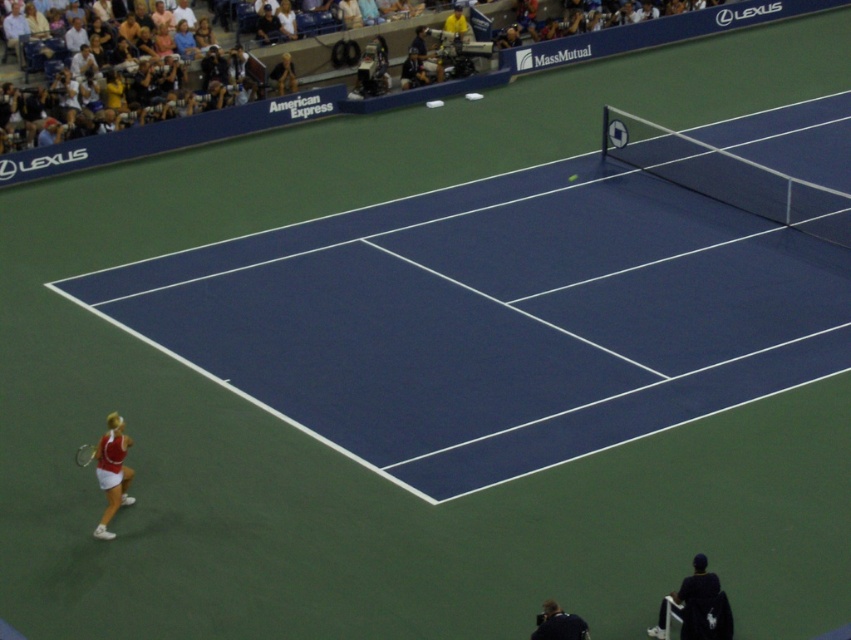
You are standing at the baseline of the tennis court and see the point marked at coordinate (120,477). If you want to reach this point quickly, should you run straight ahead or move sideways?

The point marked at coordinate (120,477) is 13.28 meters away from the viewer. Since it is a distance away, you should run straight ahead towards it to reach the point quickly.

In the scene shown: You are a tennis coach observing the match. You notice the metallic silver tennis racket at lower left and the green rubber tennis ball at center. Which object is taller in the image?

The metallic silver tennis racket at lower left is much taller than the green rubber tennis ball at center.

You are a tennis coach observing the match. The court has a coordinate system where the bottom left corner is the origin point. The metallic silver tennis racket at lower left is at a specific coordinate. Can you determine if the racket is positioned closer to the left boundary of the court compared to its right boundary?

The metallic silver tennis racket at lower left is located at point 0.711 on the x and 0.100 on the y. Since the x coordinate ranges from 0 to 1, with 0 being the left boundary, the racket is closer to the right boundary as 0.711 is closer to 1 than to 0.